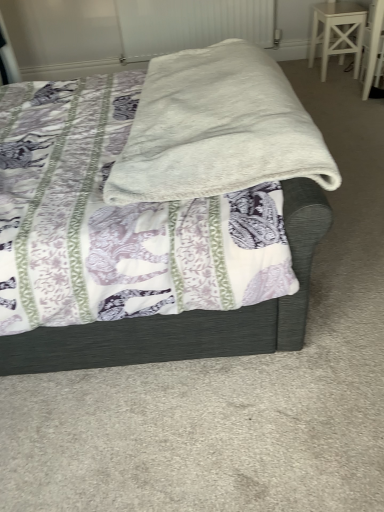
The width and height of the screenshot is (384, 512). Identify the location of white painted wood stool at upper right. [x=337, y=32].

Find the location of `white textured radiator at upper center`. white textured radiator at upper center is located at coordinates click(x=191, y=25).

Where is `white soft blanket at center`? The height and width of the screenshot is (512, 384). white soft blanket at center is located at coordinates (188, 315).

Measure the distance between white soft blanket at center and camera.

white soft blanket at center and camera are 38.98 inches apart.

Where is `white painted wood stool at upper right`? The width and height of the screenshot is (384, 512). white painted wood stool at upper right is located at coordinates (337, 32).

From the picture: From the image's perspective, would you say white soft blanket at center is shown under white painted wood stool at upper right?

Indeed, from the image's perspective, white soft blanket at center is shown beneath white painted wood stool at upper right.

Based on the photo, which of these two, white soft blanket at center or white painted wood stool at upper right, is wider?

white soft blanket at center is wider.

From the picture: Can you tell me how much white soft blanket at center and white painted wood stool at upper right differ in facing direction?

There is a 1.51-degree angle between the facing directions of white soft blanket at center and white painted wood stool at upper right.

Is white soft blanket at center surrounding white painted wood stool at upper right?

Actually, white painted wood stool at upper right is outside white soft blanket at center.

Does point (132, 34) come behind point (338, 4)?

Yes, point (132, 34) is farther from viewer.

Is white textured radiator at upper center completely or partially outside of white painted wood stool at upper right?

Yes, white textured radiator at upper center is located beyond the bounds of white painted wood stool at upper right.

Is white textured radiator at upper center facing towards white painted wood stool at upper right?

No, white textured radiator at upper center is not turned towards white painted wood stool at upper right.

Which is more to the right, white textured radiator at upper center or white painted wood stool at upper right?

white painted wood stool at upper right is more to the right.

Who is taller, white painted wood stool at upper right or white soft blanket at center?

white painted wood stool at upper right.

You are a GUI agent. You are given a task and a screenshot of the screen. Output one action in this format:
    pyautogui.click(x=<x>, y=<y>)
    Task: Click on the stool that appears on the right of white soft blanket at center
    
    Given the screenshot: What is the action you would take?
    pyautogui.click(x=337, y=32)

Does white painted wood stool at upper right contain white soft blanket at center?

No, white soft blanket at center is located outside of white painted wood stool at upper right.

Can you see white painted wood stool at upper right touching white soft blanket at center?

white painted wood stool at upper right and white soft blanket at center are not in contact.

Consider the image. In terms of size, does white painted wood stool at upper right appear bigger or smaller than white soft blanket at center?

Clearly, white painted wood stool at upper right is smaller in size than white soft blanket at center.

Considering the sizes of objects white painted wood stool at upper right and white soft blanket at center in the image provided, who is taller, white painted wood stool at upper right or white soft blanket at center?

white soft blanket at center.

Where is `stool on the right of white soft blanket at center`? stool on the right of white soft blanket at center is located at coordinates (337, 32).

Considering the points (328, 12) and (221, 25), which point is in front, point (328, 12) or point (221, 25)?

The point (328, 12) is more forward.

The width and height of the screenshot is (384, 512). I want to click on stool that appears below the white textured radiator at upper center (from the image's perspective), so click(337, 32).

From the image's perspective, which is below, white painted wood stool at upper right or white textured radiator at upper center?

white painted wood stool at upper right is shown below in the image.

From a real-world perspective, between white painted wood stool at upper right and white textured radiator at upper center, who is vertically lower?

From a 3D spatial view, white painted wood stool at upper right is below.

In the scene shown: Looking at their sizes, would you say white soft blanket at center is wider or thinner than white soft blanket at center?

In the image, white soft blanket at center appears to be wider than white soft blanket at center.

Image resolution: width=384 pixels, height=512 pixels. Find the location of `blanket above the white soft blanket at center (from the image's perspective)`. blanket above the white soft blanket at center (from the image's perspective) is located at coordinates (217, 129).

Does white soft blanket at center come in front of white soft blanket at center?

Yes, white soft blanket at center is closer to the viewer.

Considering the positions of points (277, 324) and (139, 177), is point (277, 324) closer to camera compared to point (139, 177)?

That is False.

Is white soft blanket at center not within white painted wood stool at upper right?

white soft blanket at center is positioned outside white painted wood stool at upper right.

From the image's perspective, relative to white painted wood stool at upper right, is white soft blanket at center above or below?

white soft blanket at center is situated lower than white painted wood stool at upper right in the image.

Does white soft blanket at center have a greater width compared to white painted wood stool at upper right?

Indeed, white soft blanket at center has a greater width compared to white painted wood stool at upper right.

Considering the positions of points (137, 169) and (343, 47), is point (137, 169) farther from camera compared to point (343, 47)?

No, (137, 169) is closer to viewer.

Locate an element on the screen. The height and width of the screenshot is (512, 384). stool lying behind the white soft blanket at center is located at coordinates (337, 32).

You are a GUI agent. You are given a task and a screenshot of the screen. Output one action in this format:
    pyautogui.click(x=<x>, y=<y>)
    Task: Click on the radiator that appears above the white painted wood stool at upper right (from the image's perspective)
    This screenshot has height=512, width=384.
    Given the screenshot: What is the action you would take?
    pyautogui.click(x=191, y=25)

Looking at the image, which one is located closer to white painted wood stool at upper right, white soft blanket at center or white textured radiator at upper center?

Based on the image, white textured radiator at upper center appears to be nearer to white painted wood stool at upper right.

Considering their positions, is white painted wood stool at upper right positioned further to white soft blanket at center than white textured radiator at upper center?

Among the two, white textured radiator at upper center is located further to white soft blanket at center.

When comparing their distances from white painted wood stool at upper right, does white soft blanket at center or white soft blanket at center seem further?

white soft blanket at center lies further to white painted wood stool at upper right than the other object.

From the image, which object appears to be farther from white soft blanket at center, white textured radiator at upper center or white soft blanket at center?

Based on the image, white textured radiator at upper center appears to be further to white soft blanket at center.

When comparing their distances from white soft blanket at center, does white textured radiator at upper center or white painted wood stool at upper right seem closer?

Among the two, white painted wood stool at upper right is located nearer to white soft blanket at center.

Estimate the real-world distances between objects in this image. Which object is closer to white textured radiator at upper center, white soft blanket at center or white soft blanket at center?

Based on the image, white soft blanket at center appears to be nearer to white textured radiator at upper center.

Estimate the real-world distances between objects in this image. Which object is closer to white textured radiator at upper center, white soft blanket at center or white painted wood stool at upper right?

Based on the image, white painted wood stool at upper right appears to be nearer to white textured radiator at upper center.

From the image, which object appears to be nearer to white textured radiator at upper center, white painted wood stool at upper right or white soft blanket at center?

white painted wood stool at upper right is closer to white textured radiator at upper center.

The height and width of the screenshot is (512, 384). What are the coordinates of `stool positioned between white soft blanket at center and white textured radiator at upper center from near to far` in the screenshot? It's located at (337, 32).

Image resolution: width=384 pixels, height=512 pixels. Find the location of `blanket between white soft blanket at center and white textured radiator at upper center in the front-back direction`. blanket between white soft blanket at center and white textured radiator at upper center in the front-back direction is located at coordinates (217, 129).

Identify the location of blanket between white soft blanket at center and white painted wood stool at upper right in the front-back direction. (217, 129).

At what (x,y) coordinates should I click in order to perform the action: click on stool between white soft blanket at center and white textured radiator at upper center from front to back. Please return your answer as a coordinate pair (x, y). Image resolution: width=384 pixels, height=512 pixels. Looking at the image, I should click on (337, 32).